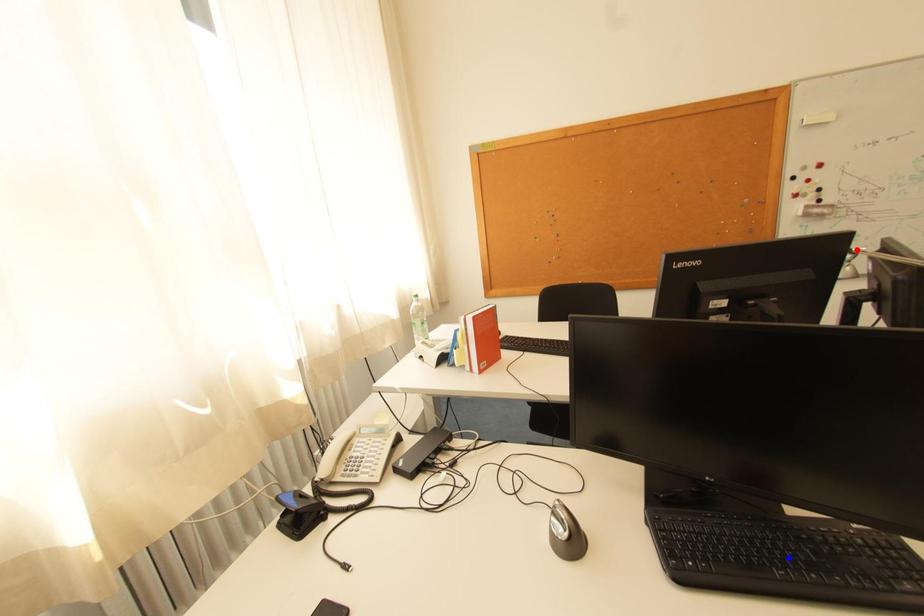
Question: In the image, two points are highlighted. Which point is nearer to the camera? Reply with the corresponding letter.

Choices:
 (A) blue point
 (B) red point

Answer: (A)